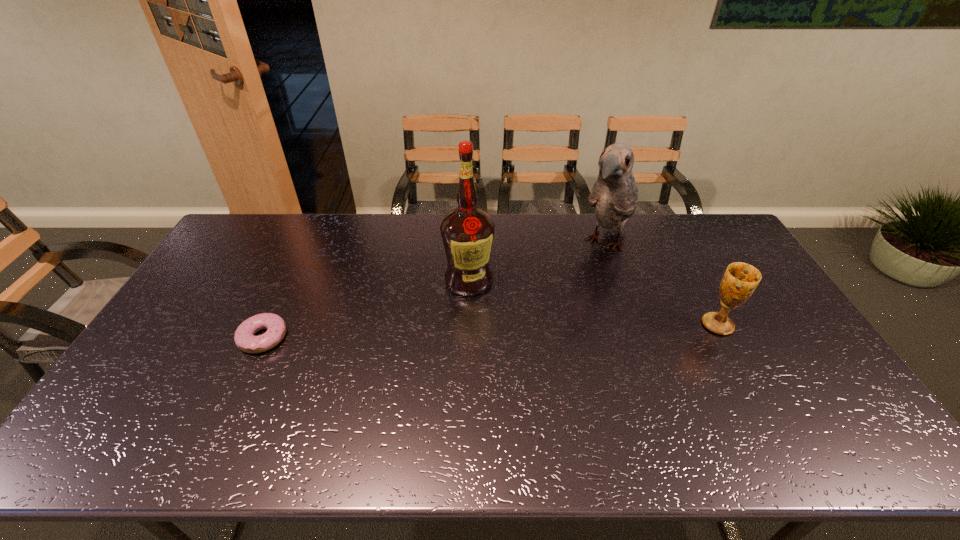
At what (x,y) coordinates should I click in order to perform the action: click on free spot on the desktop that is between the leftmost object and the third tallest object and is positioned on the label of the alcohol. Please return your answer as a coordinate pair (x, y). Looking at the image, I should click on (434, 333).

Locate an element on the screen. Image resolution: width=960 pixels, height=540 pixels. free space on the desktop that is between the shortest object and the second shortest object and is positioned on the front-facing side of the parrot is located at coordinates (549, 329).